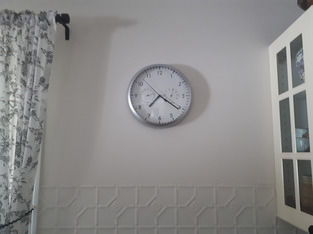
What are the coordinates of `curtain holder` in the screenshot? It's located at (62, 16).